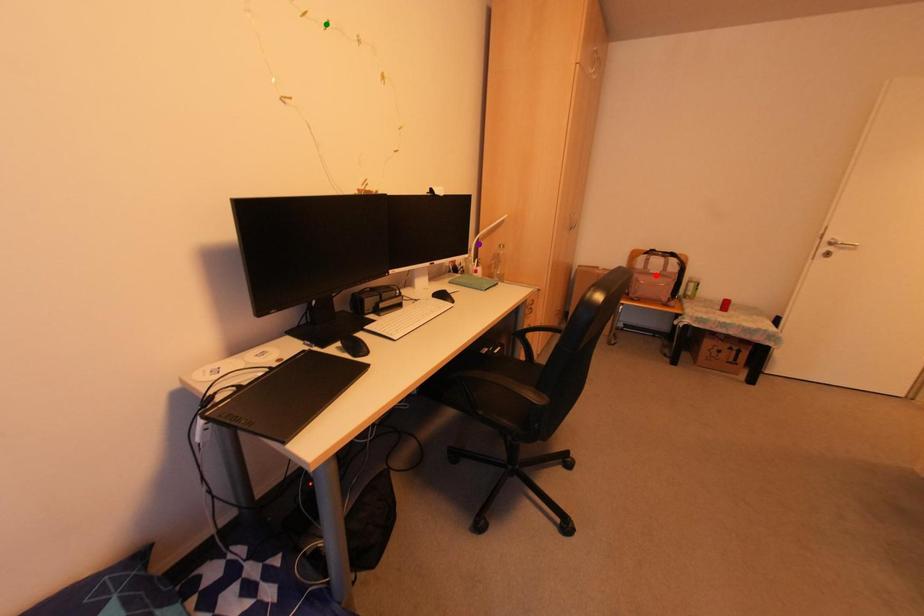
Order these from nearest to farthest:
purple point | green point | red point

red point
purple point
green point